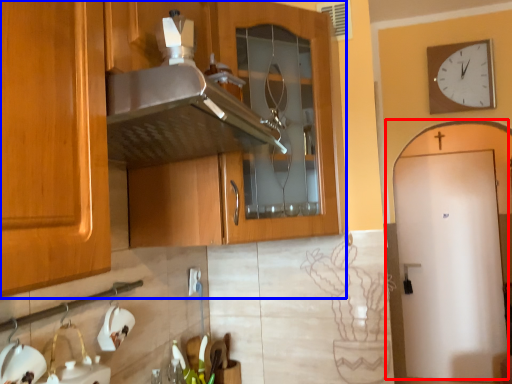
Question: Which object is further to the camera taking this photo, door (highlighted by a red box) or cabinetry (highlighted by a blue box)?

Choices:
 (A) door
 (B) cabinetry

Answer: (A)